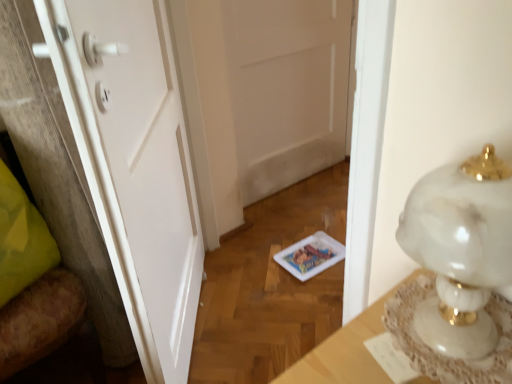
This screenshot has height=384, width=512. Find the location of `free space below white marble lamp at right (from a real-world perspective)`. free space below white marble lamp at right (from a real-world perspective) is located at coordinates 445,334.